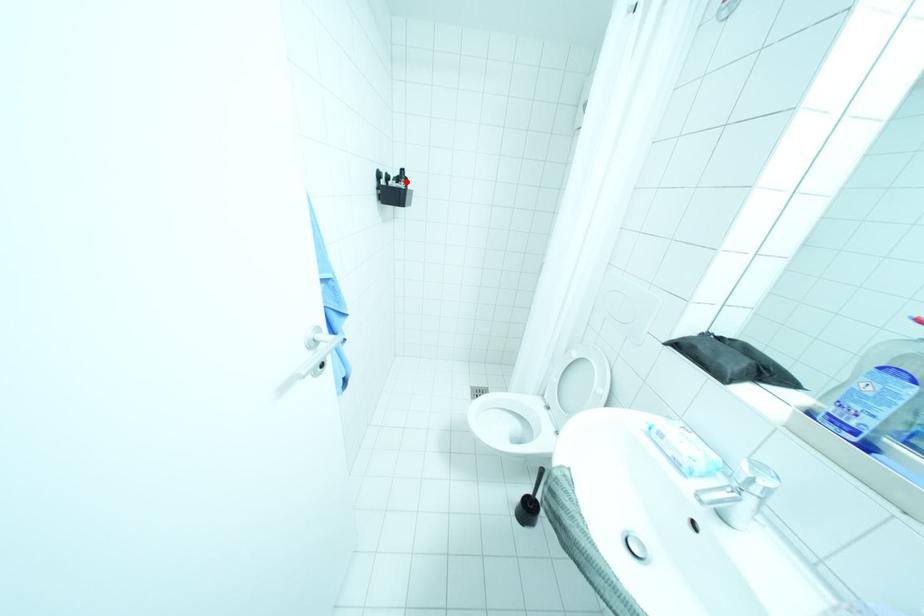
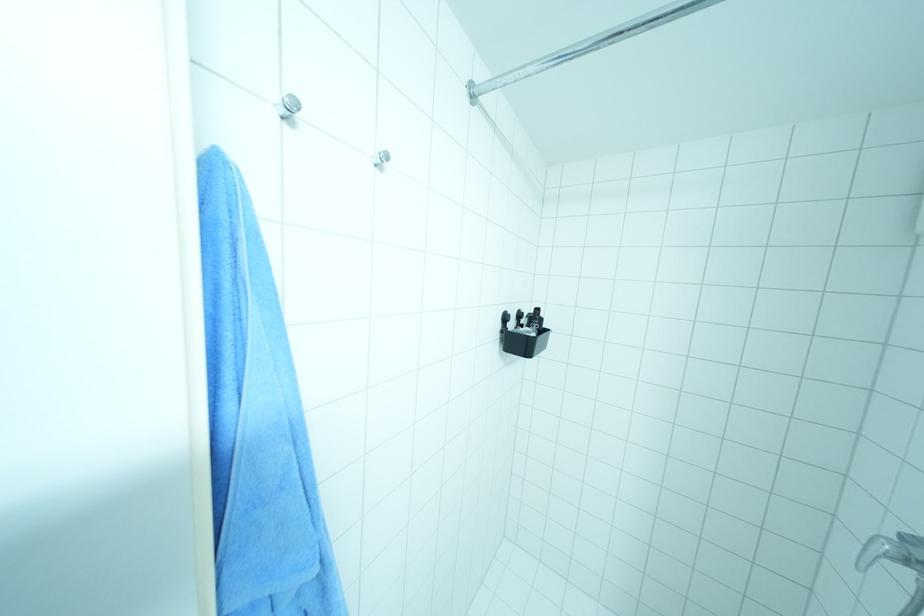
Find the pixel in the second image that matches the highlighted location in the first image.

(538, 323)